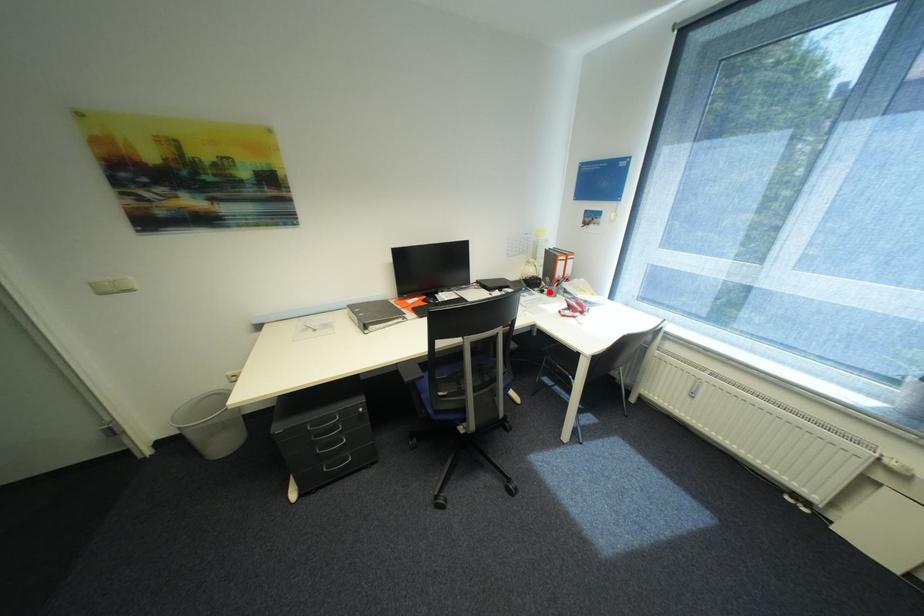
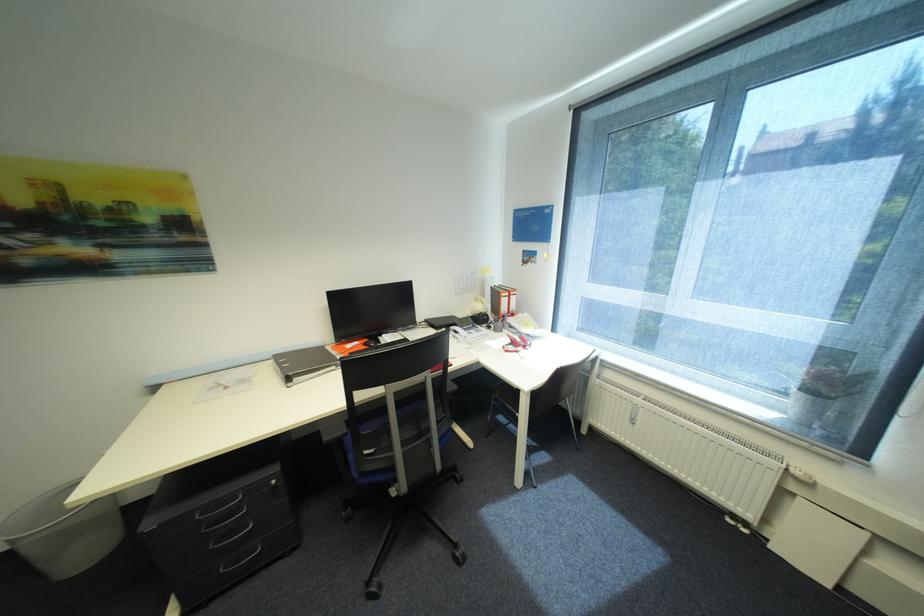
Locate, in the second image, the point that corresponds to the highlighted location in the first image.

(496, 328)